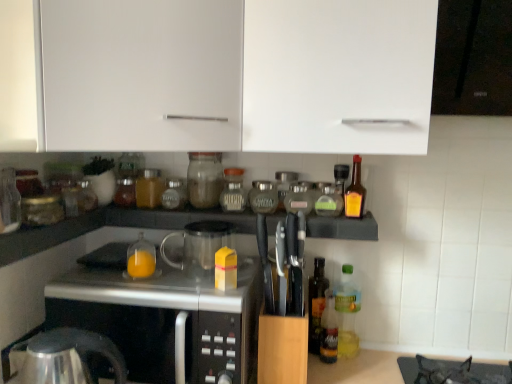
The width and height of the screenshot is (512, 384). I want to click on empty space that is in between translucent glass jar at center, positioned as the 8th bottle in right-to-left order, and matte glass jar at center, which is the 7th bottle in left-to-right order, so click(x=201, y=207).